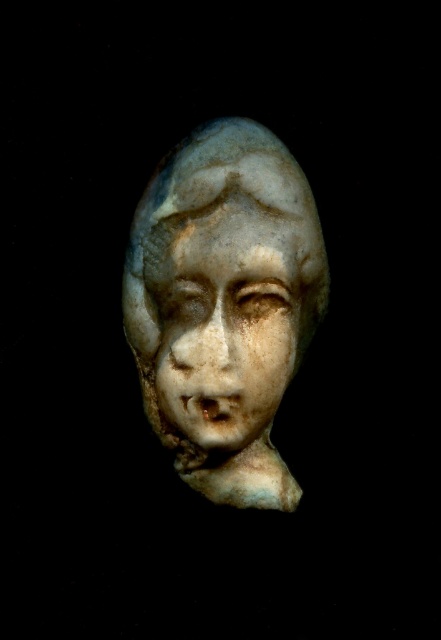
Does point (205, 371) come behind point (246, 440)?

That is False.

Identify the location of white marble bust at center. This screenshot has width=441, height=640. (224, 305).